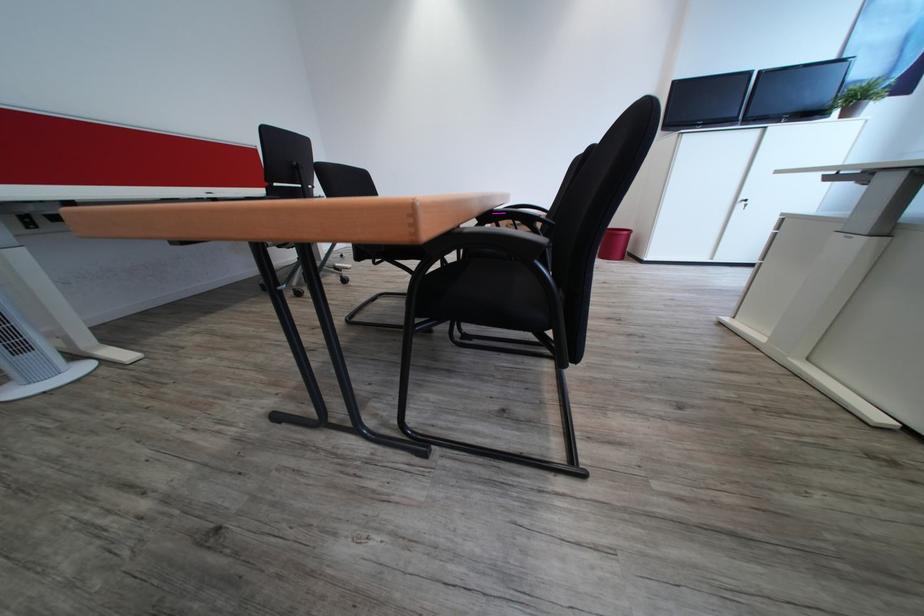
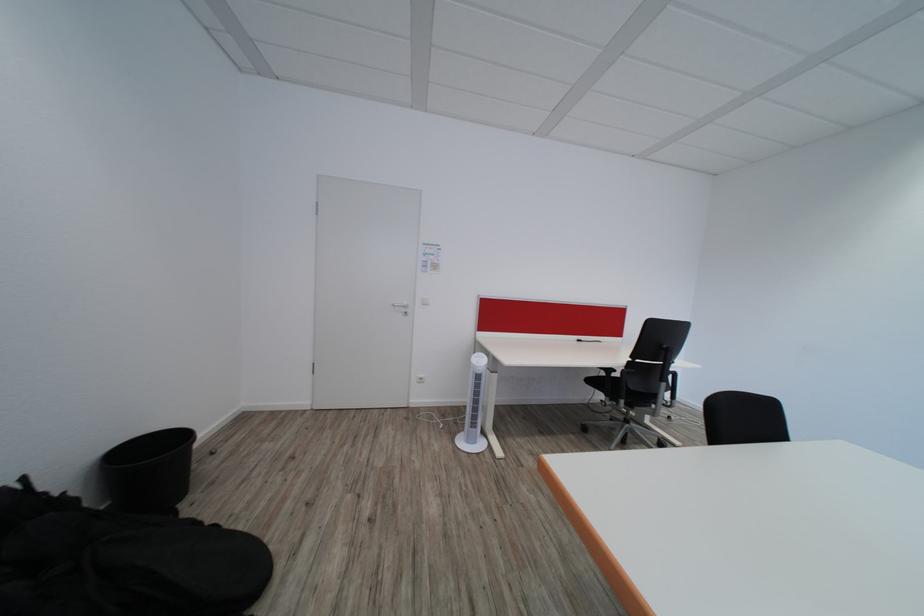
The point at [323,188] is marked in the first image. Where is the corresponding point in the second image?

(684, 365)